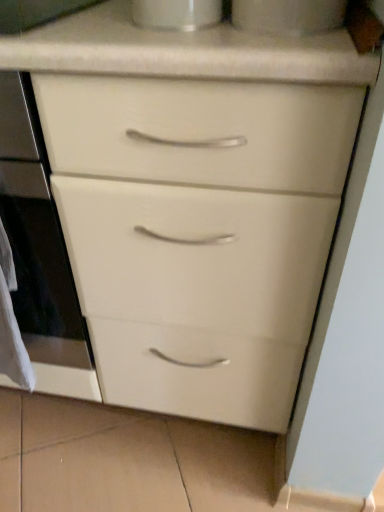
Question: Does white glossy oven at center turn towards white paper at left?

Choices:
 (A) no
 (B) yes

Answer: (B)

Question: Is white glossy oven at center bigger than white paper at left?

Choices:
 (A) no
 (B) yes

Answer: (B)

Question: Can you confirm if white glossy oven at center is taller than white paper at left?

Choices:
 (A) yes
 (B) no

Answer: (A)

Question: Can you confirm if white glossy oven at center is wider than white paper at left?

Choices:
 (A) yes
 (B) no

Answer: (A)

Question: Is white glossy oven at center positioned with its back to white paper at left?

Choices:
 (A) yes
 (B) no

Answer: (B)

Question: From a real-world perspective, is white glossy oven at center located beneath white paper at left?

Choices:
 (A) no
 (B) yes

Answer: (A)

Question: Considering the relative positions of white glossy cup at upper center, marked as the second appliance in a right-to-left arrangement, and white paper at left in the image provided, is white glossy cup at upper center, marked as the second appliance in a right-to-left arrangement, behind white paper at left?

Choices:
 (A) no
 (B) yes

Answer: (A)

Question: Is white glossy cup at upper center, which appears as the 1th appliance when viewed from the left, far away from white paper at left?

Choices:
 (A) no
 (B) yes

Answer: (A)

Question: Is white glossy cup at upper center, marked as the second appliance in a right-to-left arrangement, turned away from white paper at left?

Choices:
 (A) no
 (B) yes

Answer: (A)

Question: Does white glossy cup at upper center, marked as the second appliance in a right-to-left arrangement, have a lesser width compared to white paper at left?

Choices:
 (A) yes
 (B) no

Answer: (B)

Question: Does white glossy cup at upper center, which appears as the 1th appliance when viewed from the left, touch white paper at left?

Choices:
 (A) no
 (B) yes

Answer: (A)

Question: Is white glossy cup at upper center, marked as the second appliance in a right-to-left arrangement, shorter than white paper at left?

Choices:
 (A) yes
 (B) no

Answer: (A)

Question: Considering the relative sizes of white paper at left and white glossy cup at upper center, marked as the second appliance in a right-to-left arrangement, in the image provided, is white paper at left bigger than white glossy cup at upper center, marked as the second appliance in a right-to-left arrangement,?

Choices:
 (A) yes
 (B) no

Answer: (A)